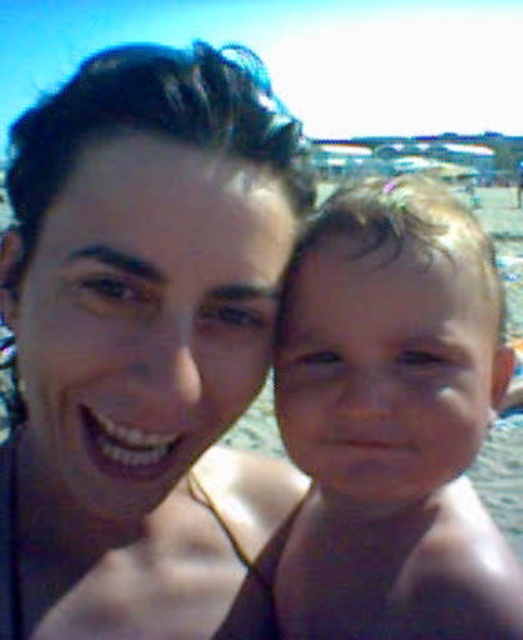
You are a photographer capturing a beach scene. You need to ensure the smooth skin baby at center and the clear blue water at baby right are both visible in your shot. Based on their positions, which object is closer to the left side of the frame?

The smooth skin baby at center is closer to the left side of the frame because it is positioned to the left of the clear blue water at baby right.

You are a photographer trying to capture a candid shot of the smooth skin baby at center and the clear blue water at baby right. Since the baby is partially obscured, can you adjust your position to see both subjects clearly?

The smooth skin baby at center is in front of the clear blue water at baby right, so moving your camera position slightly to the side or angle might allow you to capture both subjects without obstruction.